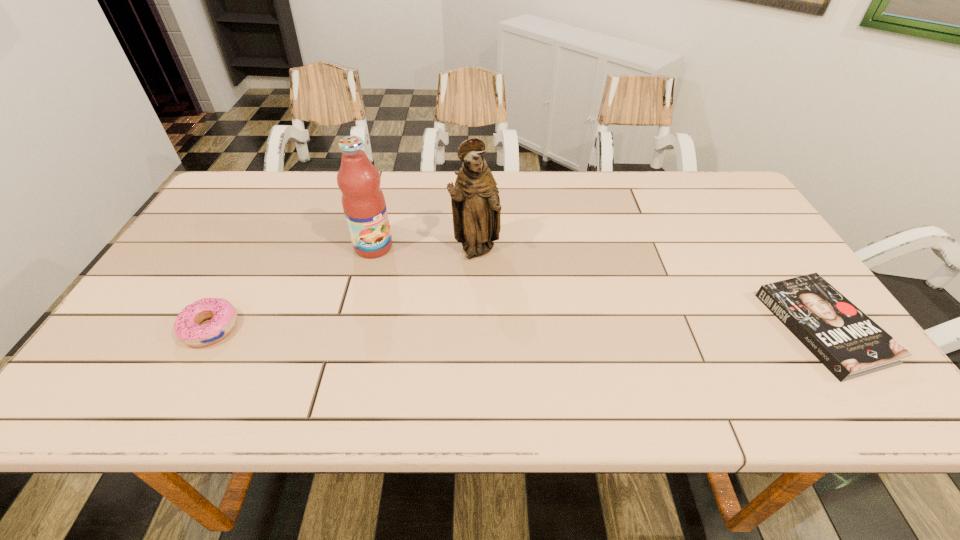
The width and height of the screenshot is (960, 540). Find the location of `free space at the far edge of the desktop`. free space at the far edge of the desktop is located at coordinates 535,185.

The image size is (960, 540). I want to click on vacant space at the near edge, so click(x=215, y=350).

The image size is (960, 540). Identify the location of vacant space at the left edge of the desktop. (191, 246).

In the image, there is a desktop. Identify the location of blank space at the right edge. Image resolution: width=960 pixels, height=540 pixels. (x=757, y=267).

Where is `vacant space at the near left corner`? The width and height of the screenshot is (960, 540). vacant space at the near left corner is located at coordinates (172, 356).

Find the location of a particular element. The image size is (960, 540). empty space between the book and the fruit juice is located at coordinates (598, 287).

I want to click on blank region between the second object from right to left and the fruit juice, so click(x=424, y=248).

Identify the location of vacant space that is in between the shortest object and the third object from right to left. (598, 287).

Locate an element on the screen. This screenshot has height=540, width=960. free space between the figurine and the book is located at coordinates (650, 288).

Locate an element on the screen. This screenshot has height=540, width=960. free space between the book and the figurine is located at coordinates (650, 288).